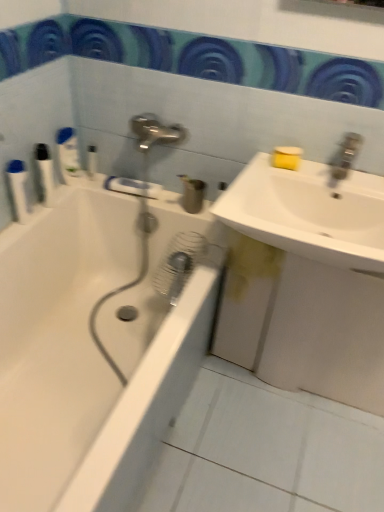
Locate an element on the screen. vacant area on top of white ceramic tile at lower center (from a real-world perspective) is located at coordinates (275, 442).